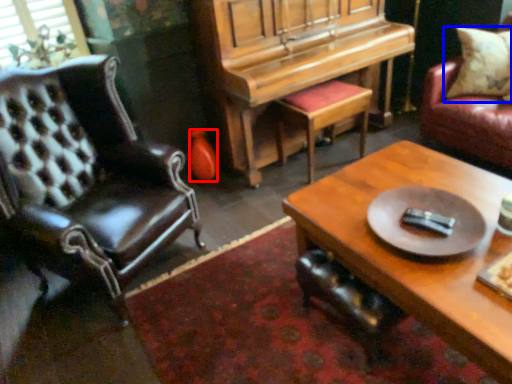
Question: Which point is further to the camera, vase (highlighted by a red box) or pillow (highlighted by a blue box)?

Choices:
 (A) vase
 (B) pillow

Answer: (A)